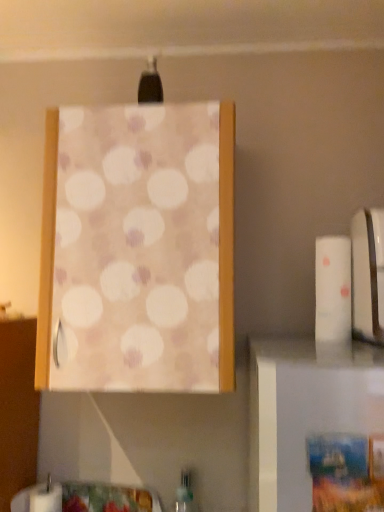
Question: Considering the relative positions of green translucent bottle at lower center and white matte toilet paper at right in the image provided, is green translucent bottle at lower center behind white matte toilet paper at right?

Choices:
 (A) no
 (B) yes

Answer: (B)

Question: From a real-world perspective, is green translucent bottle at lower center located higher than white matte toilet paper at right?

Choices:
 (A) no
 (B) yes

Answer: (A)

Question: Can you confirm if green translucent bottle at lower center is thinner than white matte toilet paper at right?

Choices:
 (A) yes
 (B) no

Answer: (A)

Question: From the image's perspective, does green translucent bottle at lower center appear higher than white matte toilet paper at right?

Choices:
 (A) yes
 (B) no

Answer: (B)

Question: Does green translucent bottle at lower center turn towards white matte toilet paper at right?

Choices:
 (A) no
 (B) yes

Answer: (A)

Question: Is green translucent bottle at lower center far away from white matte toilet paper at right?

Choices:
 (A) no
 (B) yes

Answer: (A)

Question: Is white matte toilet paper at right beside green translucent bottle at lower center?

Choices:
 (A) yes
 (B) no

Answer: (B)

Question: Is green translucent bottle at lower center completely or partially inside white matte toilet paper at right?

Choices:
 (A) yes
 (B) no

Answer: (B)

Question: Could you tell me if white matte toilet paper at right is facing green translucent bottle at lower center?

Choices:
 (A) yes
 (B) no

Answer: (B)

Question: Considering the relative sizes of white matte toilet paper at right and green translucent bottle at lower center in the image provided, is white matte toilet paper at right thinner than green translucent bottle at lower center?

Choices:
 (A) no
 (B) yes

Answer: (A)

Question: Does white matte toilet paper at right appear on the right side of green translucent bottle at lower center?

Choices:
 (A) no
 (B) yes

Answer: (B)

Question: Is white matte toilet paper at right not close to green translucent bottle at lower center?

Choices:
 (A) yes
 (B) no

Answer: (B)

Question: From the image's perspective, is white glossy toaster at right beneath green translucent bottle at lower center?

Choices:
 (A) yes
 (B) no

Answer: (B)